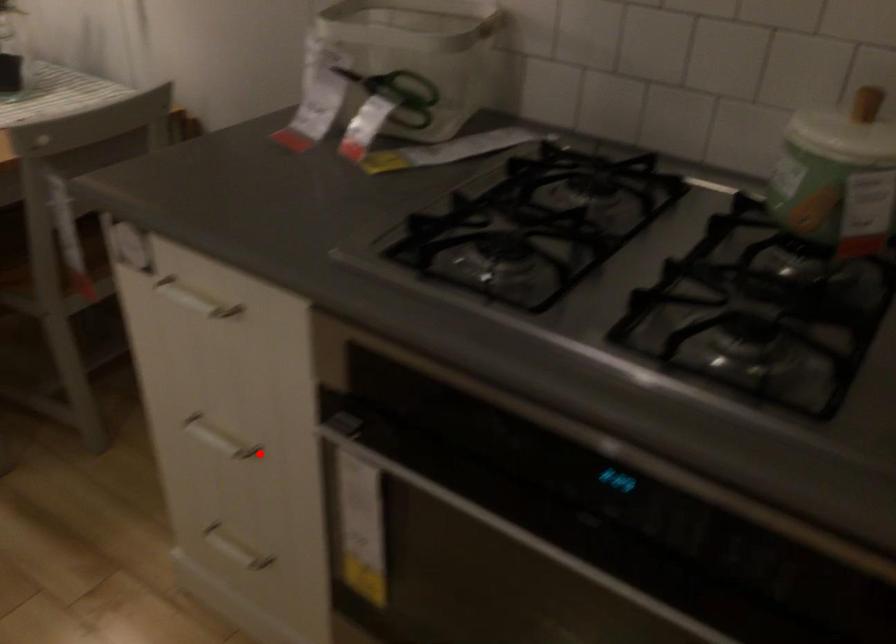
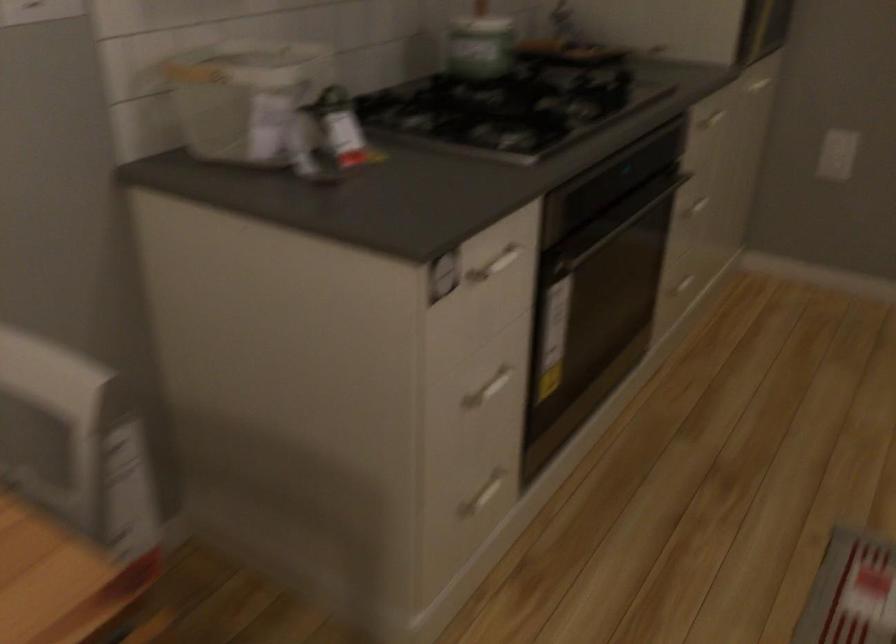
Question: I am providing you with two images of the same scene from different viewpoints. In image1, a red point is highlighted. Considering the same 3D point in image2, which of the following is correct?

Choices:
 (A) It is closer
 (B) It is farther

Answer: (B)